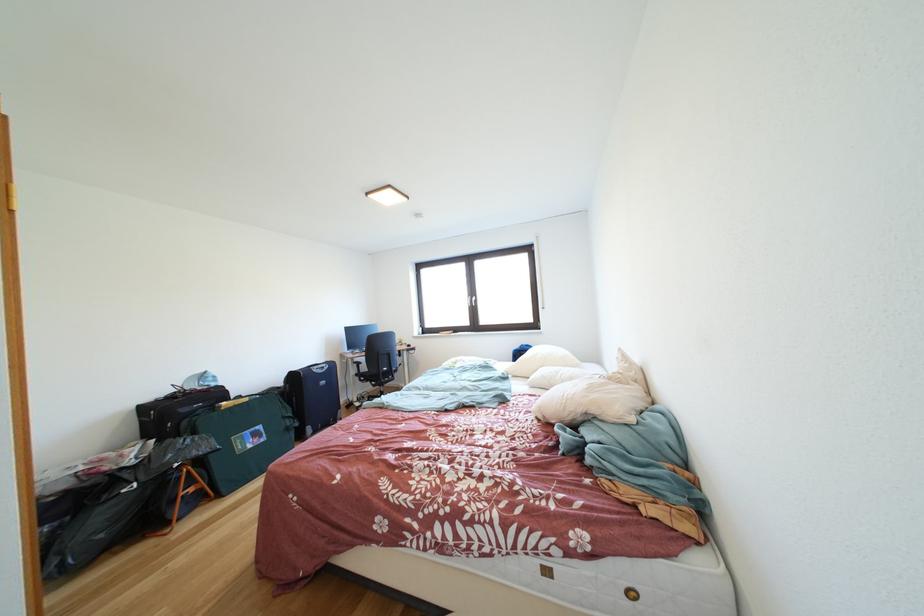
The height and width of the screenshot is (616, 924). Describe the element at coordinates (470, 301) in the screenshot. I see `a silver window handle` at that location.